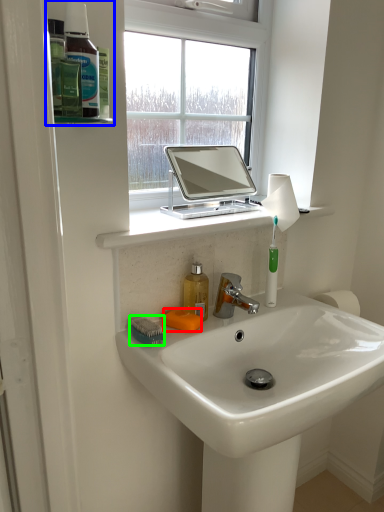
Question: Which object is positioned closest to soap (highlighted by a red box)? Select from shelf (highlighted by a blue box) and brush (highlighted by a green box).

Choices:
 (A) shelf
 (B) brush

Answer: (B)